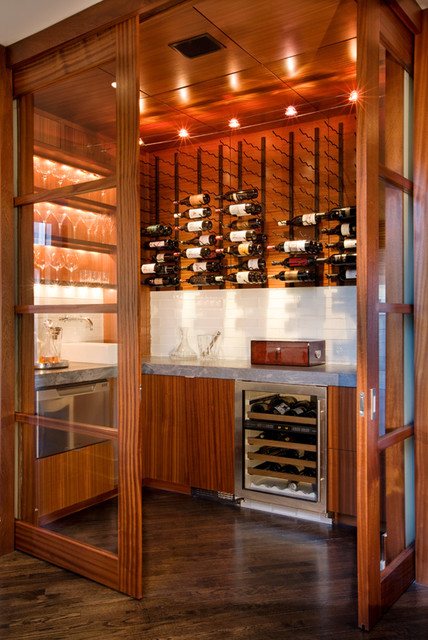
Where is `white ceiling`? The height and width of the screenshot is (640, 428). white ceiling is located at coordinates pos(21,15).